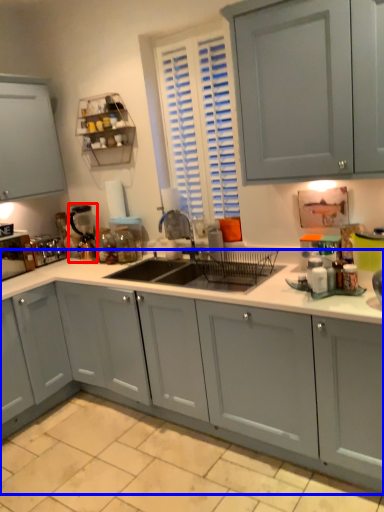
Question: Among these objects, which one is nearest to the camera, appliance (highlighted by a red box) or countertop (highlighted by a blue box)?

Choices:
 (A) appliance
 (B) countertop

Answer: (B)